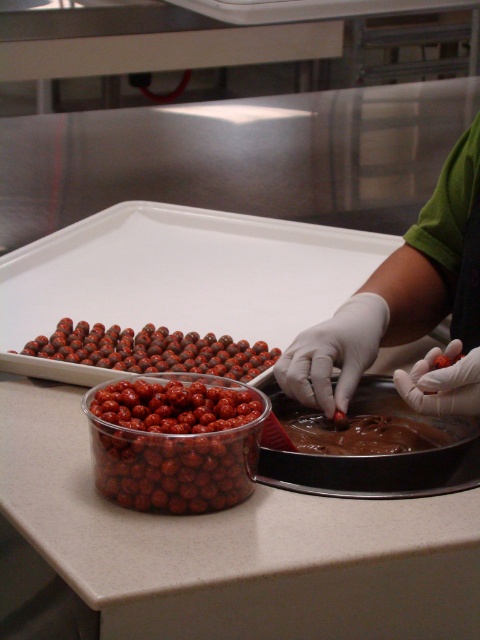
Question: Considering the real-world distances, which object is farthest from the shiny red chocolate at center?

Choices:
 (A) chocolate smooth at center
 (B) glossy red chocolate at center

Answer: (B)

Question: Which object appears closest to the camera in this image?

Choices:
 (A) chocolate smooth at center
 (B) shiny red chocolate at center
 (C) glossy red chocolate at center

Answer: (B)

Question: Considering the relative positions of shiny red chocolate at center and chocolate smooth at center in the image provided, where is shiny red chocolate at center located with respect to chocolate smooth at center?

Choices:
 (A) below
 (B) above

Answer: (B)

Question: Is glossy red chocolate at center closer to the viewer compared to chocolate smooth at center?

Choices:
 (A) no
 (B) yes

Answer: (A)

Question: Is glossy red chocolate at center further to camera compared to chocolate smooth at center?

Choices:
 (A) no
 (B) yes

Answer: (B)

Question: Which point is farther from the camera taking this photo?

Choices:
 (A) click(78, 348)
 (B) click(315, 417)

Answer: (A)